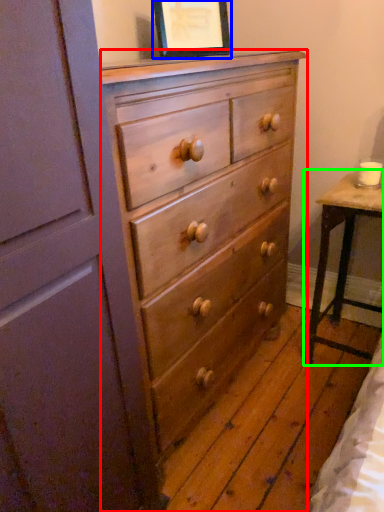
Question: Which is farther away from chest of drawers (highlighted by a red box)? picture frame (highlighted by a blue box) or table (highlighted by a green box)?

Choices:
 (A) picture frame
 (B) table

Answer: (A)